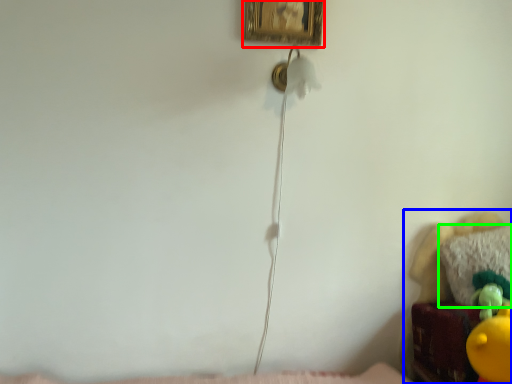
Question: Which object is positioned farthest from picture frame (highlighted by a red box)? Select from furniture (highlighted by a blue box) and pillow (highlighted by a green box).

Choices:
 (A) furniture
 (B) pillow

Answer: (B)